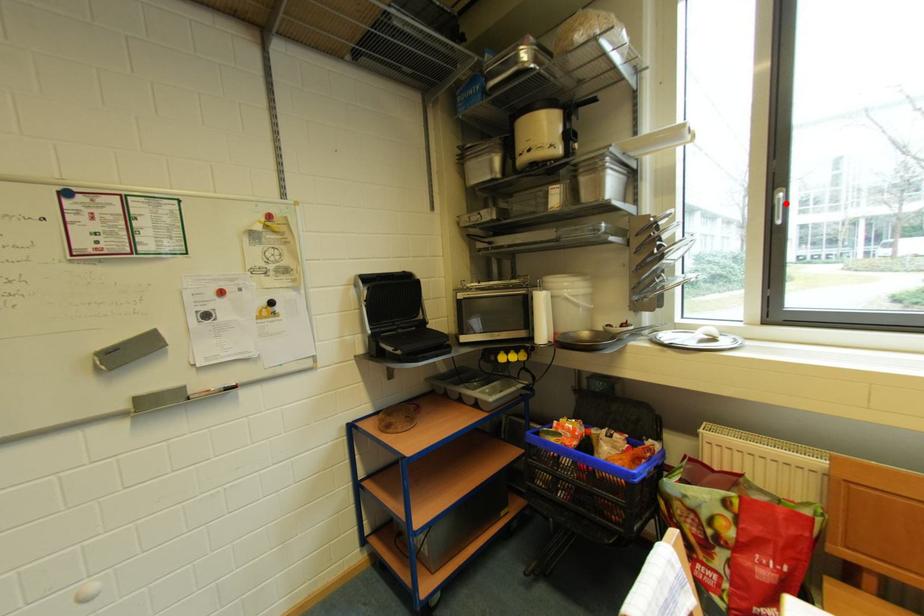
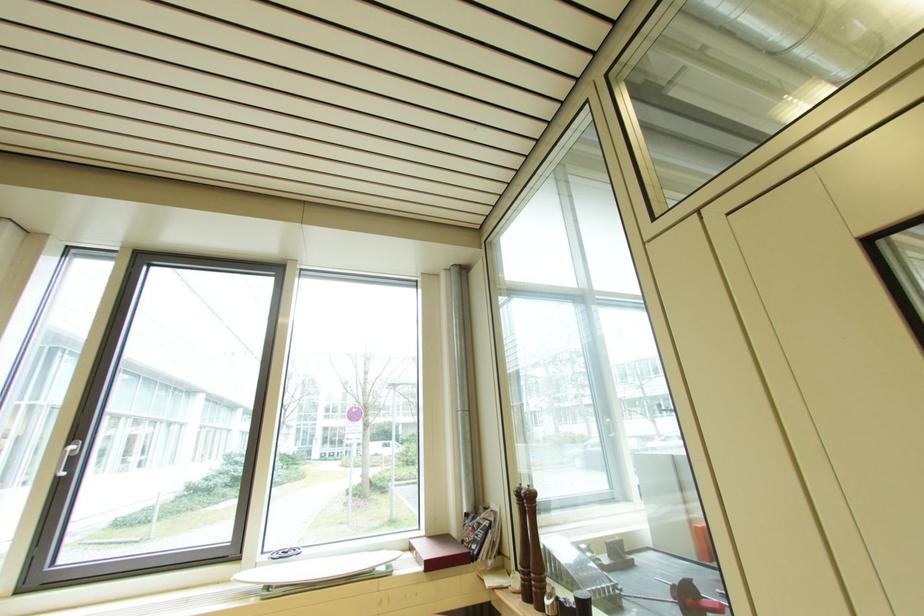
In the second image, find the point that corresponds to the highlighted location in the first image.

(73, 455)